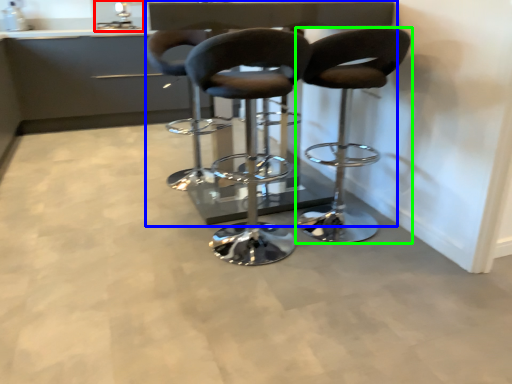
Question: Which object is the closest to the sink (highlighted by a red box)? Choose among these: table (highlighted by a blue box) or chair (highlighted by a green box).

Choices:
 (A) table
 (B) chair

Answer: (A)